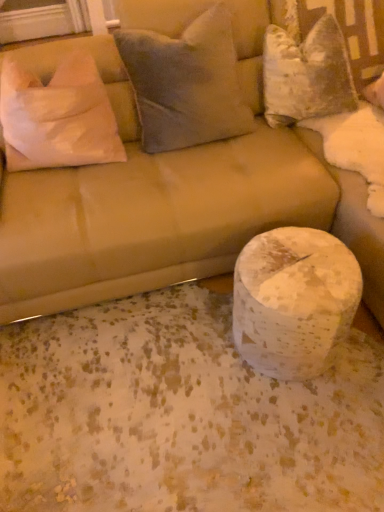
Question: Should I look upward or downward to see white fabric pillow at left, marked as the third pillow in a right-to-left arrangement?

Choices:
 (A) up
 (B) down

Answer: (A)

Question: Is velvety gray pillow at upper center, placed as the 2th pillow when sorted from left to right, outside of white fabric pillow at left, which ranks as the first pillow in left-to-right order?

Choices:
 (A) no
 (B) yes

Answer: (B)

Question: Considering the relative positions of velvety gray pillow at upper center, which is the 2th pillow from right to left, and white fabric pillow at left, which ranks as the first pillow in left-to-right order, in the image provided, is velvety gray pillow at upper center, which is the 2th pillow from right to left, to the right of white fabric pillow at left, which ranks as the first pillow in left-to-right order, from the viewer's perspective?

Choices:
 (A) no
 (B) yes

Answer: (B)

Question: Does velvety gray pillow at upper center, which is the 2th pillow from right to left, come behind white fabric pillow at left, marked as the third pillow in a right-to-left arrangement?

Choices:
 (A) no
 (B) yes

Answer: (A)

Question: Is velvety gray pillow at upper center, which is the 2th pillow from right to left, in front of white fabric pillow at left, marked as the third pillow in a right-to-left arrangement?

Choices:
 (A) no
 (B) yes

Answer: (B)

Question: From a real-world perspective, is velvety gray pillow at upper center, which is the 2th pillow from right to left, physically above white fabric pillow at left, which ranks as the first pillow in left-to-right order?

Choices:
 (A) no
 (B) yes

Answer: (B)

Question: From the image's perspective, is velvety gray pillow at upper center, placed as the 2th pillow when sorted from left to right, below white fabric pillow at left, which ranks as the first pillow in left-to-right order?

Choices:
 (A) yes
 (B) no

Answer: (B)

Question: Considering the relative positions of white fabric pillow at left, which ranks as the first pillow in left-to-right order, and white speckled marble at lower right in the image provided, is white fabric pillow at left, which ranks as the first pillow in left-to-right order, to the left of white speckled marble at lower right from the viewer's perspective?

Choices:
 (A) yes
 (B) no

Answer: (A)

Question: Is the position of white fabric pillow at left, marked as the third pillow in a right-to-left arrangement, less distant than that of white speckled marble at lower right?

Choices:
 (A) yes
 (B) no

Answer: (B)

Question: From a real-world perspective, is white fabric pillow at left, which ranks as the first pillow in left-to-right order, over white speckled marble at lower right?

Choices:
 (A) no
 (B) yes

Answer: (B)

Question: Is there a large distance between white fabric pillow at left, marked as the third pillow in a right-to-left arrangement, and white speckled marble at lower right?

Choices:
 (A) yes
 (B) no

Answer: (B)

Question: Is white fabric pillow at left, marked as the third pillow in a right-to-left arrangement, placed right next to white speckled marble at lower right?

Choices:
 (A) yes
 (B) no

Answer: (B)

Question: Is white fabric pillow at left, which ranks as the first pillow in left-to-right order, oriented towards white speckled marble at lower right?

Choices:
 (A) no
 (B) yes

Answer: (A)

Question: Could suede beige couch at center be considered to be inside white speckled marble at lower right?

Choices:
 (A) yes
 (B) no

Answer: (B)